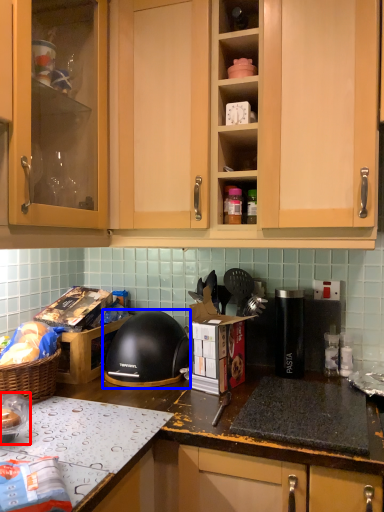
Question: Which of the following is the closest to the observer, appliance (highlighted by a red box) or helmet (highlighted by a blue box)?

Choices:
 (A) appliance
 (B) helmet

Answer: (A)